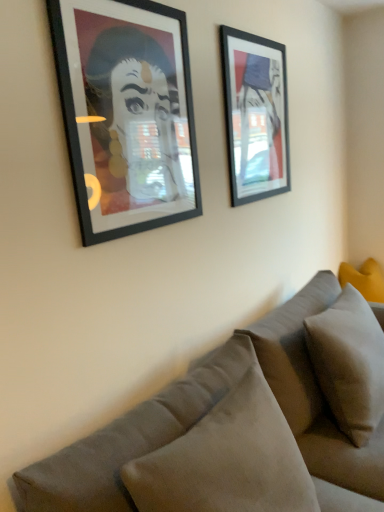
Question: Would you say matte black picture frame at upper right, the first picture frame from the back, is a long distance from yellow fabric pillow at right, placed as the third pillow when sorted from front to back?

Choices:
 (A) no
 (B) yes

Answer: (B)

Question: From a real-world perspective, is matte black picture frame at upper right, the first picture frame from the back, under yellow fabric pillow at right, placed as the third pillow when sorted from front to back?

Choices:
 (A) no
 (B) yes

Answer: (A)

Question: Is the position of matte black picture frame at upper right, placed as the second picture frame when sorted from front to back, less distant than that of yellow fabric pillow at right, arranged as the 1th pillow when viewed from the right?

Choices:
 (A) no
 (B) yes

Answer: (B)

Question: Is the depth of matte black picture frame at upper right, the second picture frame when ordered from left to right, greater than that of yellow fabric pillow at right, which is counted as the third pillow, starting from the left?

Choices:
 (A) yes
 (B) no

Answer: (B)

Question: Is matte black picture frame at upper right, placed as the second picture frame when sorted from front to back, completely or partially outside of yellow fabric pillow at right, which is counted as the third pillow, starting from the left?

Choices:
 (A) yes
 (B) no

Answer: (A)

Question: Does matte black picture frame at upper right, acting as the first picture frame starting from the right, appear on the left side of yellow fabric pillow at right, arranged as the 1th pillow when viewed from the right?

Choices:
 (A) no
 (B) yes

Answer: (B)

Question: Is matte black picture frame at left, the first picture frame viewed from the front, thinner than velvet gray couch at lower right?

Choices:
 (A) yes
 (B) no

Answer: (A)

Question: Considering the relative sizes of matte black picture frame at left, the 1th picture frame when ordered from left to right, and velvet gray couch at lower right in the image provided, is matte black picture frame at left, the 1th picture frame when ordered from left to right, taller than velvet gray couch at lower right?

Choices:
 (A) yes
 (B) no

Answer: (B)

Question: From the image's perspective, would you say matte black picture frame at left, the first picture frame viewed from the front, is shown under velvet gray couch at lower right?

Choices:
 (A) no
 (B) yes

Answer: (A)

Question: Is matte black picture frame at left, the 2th picture frame from the back, shorter than velvet gray couch at lower right?

Choices:
 (A) no
 (B) yes

Answer: (B)

Question: Considering the relative sizes of matte black picture frame at left, the first picture frame viewed from the front, and velvet gray couch at lower right in the image provided, is matte black picture frame at left, the first picture frame viewed from the front, smaller than velvet gray couch at lower right?

Choices:
 (A) yes
 (B) no

Answer: (A)

Question: Can you confirm if matte black picture frame at left, acting as the 2th picture frame starting from the right, is positioned to the left of velvet gray couch at lower right?

Choices:
 (A) no
 (B) yes

Answer: (B)

Question: Is velvet gray couch at lower right taller than yellow fabric pillow at right, which is counted as the third pillow, starting from the left?

Choices:
 (A) no
 (B) yes

Answer: (B)